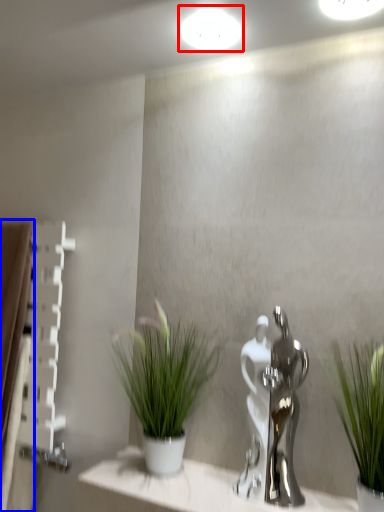
Question: Which object is closer to the camera taking this photo, lighting (highlighted by a red box) or curtain (highlighted by a blue box)?

Choices:
 (A) lighting
 (B) curtain

Answer: (A)